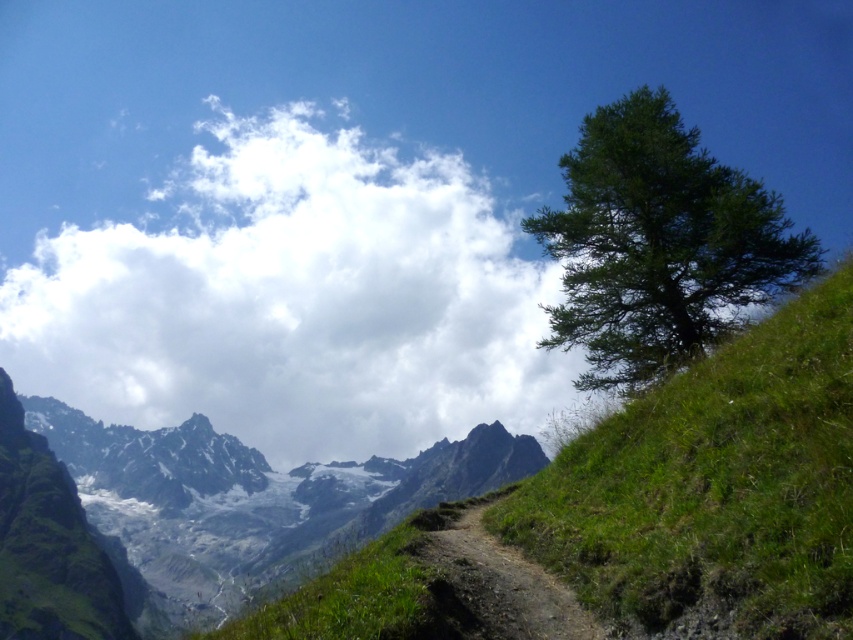
Question: Is snowy granite mountains at center closer to camera compared to green leafy tree at right?

Choices:
 (A) no
 (B) yes

Answer: (A)

Question: Which object is farther from the camera taking this photo?

Choices:
 (A) white fluffy cloud at upper center
 (B) dirt/gravel trail at lower center
 (C) snowy granite mountains at center
 (D) green grassy hillside at right

Answer: (C)

Question: Among these points, which one is nearest to the camera?

Choices:
 (A) (245, 496)
 (B) (712, 250)

Answer: (B)

Question: Among these points, which one is nearest to the camera?

Choices:
 (A) (712, 304)
 (B) (503, 458)
 (C) (543, 630)
 (D) (433, 202)

Answer: (C)

Question: Where is white fluffy cloud at upper center located in relation to green leafy tree at right in the image?

Choices:
 (A) right
 (B) left

Answer: (B)

Question: Does green leafy tree at right lie behind dirt/gravel trail at lower center?

Choices:
 (A) yes
 (B) no

Answer: (A)